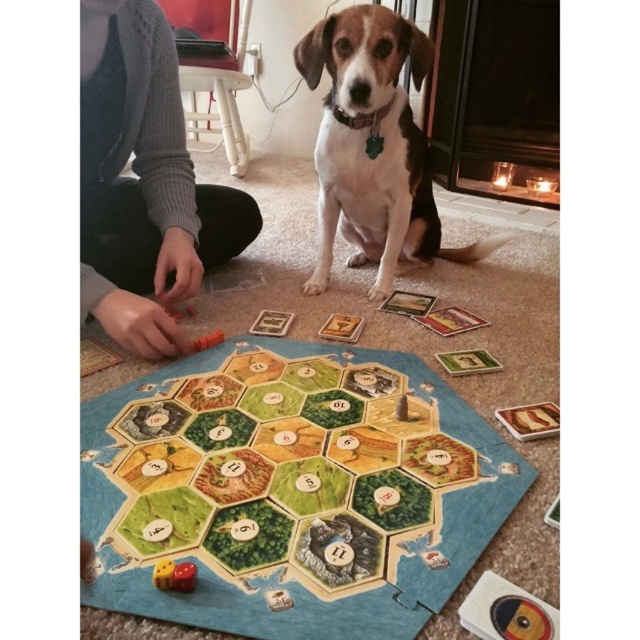
You are playing Catan and need to place a new road. The rule says it must be adjacent to either the wooden hexagonal tiles at center or the brown and white fur dog at center. Which object can you place the road next to?

You can place the road next to the wooden hexagonal tiles at center because the brown and white fur dog at center is not part of the game board, while the wooden hexagonal tiles at center are the actual game components.

You are a game designer observing the Catan board setup. You need to determine if the wooden hexagonal tiles at center can be moved to the side to make space for the brown and white fur dog at center to lie down comfortably. Can you do this without overlapping?

The wooden hexagonal tiles at center is smaller than brown and white fur dog at center, so yes, the tiles can be moved to the side to accommodate the dog without overlapping since the tiles are smaller in size.